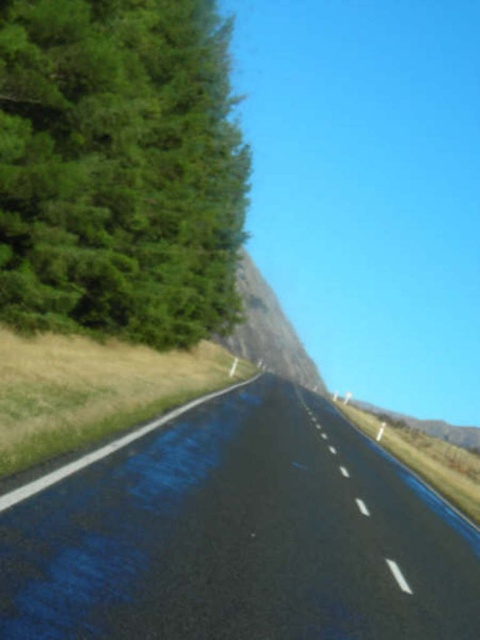
You are a self driving car navigating a wet road. You see the point marked at coordinates (x=240, y=536). What is the object at that point?

The point at coordinates (x=240, y=536) marks the black asphalt road at center.

Consider the image. You are a delivery drone flying above the road and need to land on the black asphalt road at center. What are the coordinates where you should aim to land?

The black asphalt road at center is located at point (240, 536), so you should aim for those coordinates to land safely.

You are driving a delivery van that is 4.5 meters long. You need to navigate a narrow section of the black asphalt road at center. Can your van safely pass through this section without touching the steep rocky cliff on the right or the dense coniferous trees on the left?

The black asphalt road at center is 4.45 meters from camera. Since the van is 4.5 meters long, it is slightly longer than the road width. Therefore, the van may not safely pass through without risking contact with the cliff or trees.